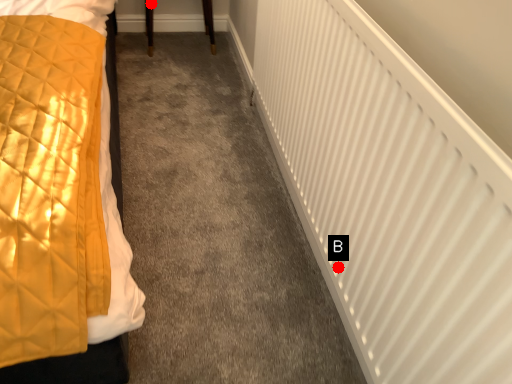
Question: Two points are circled on the image, labeled by A and B beside each circle. Which point is closer to the camera?

Choices:
 (A) A is closer
 (B) B is closer

Answer: (B)